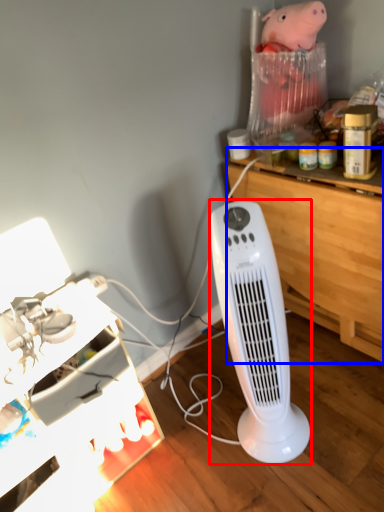
Question: Which object appears farthest to the camera in this image, home appliance (highlighted by a red box) or computer desk (highlighted by a blue box)?

Choices:
 (A) home appliance
 (B) computer desk

Answer: (B)